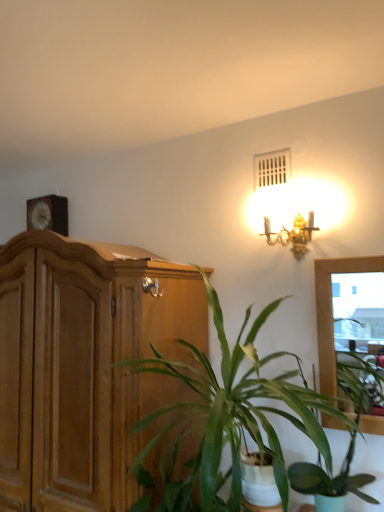
Question: Which direction should I rotate to look at green leafy plant at center, the 1th houseplant positioned from the right, — up or down?

Choices:
 (A) down
 (B) up

Answer: (A)

Question: Is gold metallic sconce at upper right taller than green leafy plant at center, marked as the second houseplant in a right-to-left arrangement?

Choices:
 (A) no
 (B) yes

Answer: (A)

Question: Is gold metallic sconce at upper right oriented towards green leafy plant at center, marked as the second houseplant in a right-to-left arrangement?

Choices:
 (A) yes
 (B) no

Answer: (B)

Question: Is gold metallic sconce at upper right outside of green leafy plant at center, the 1th houseplant when ordered from left to right?

Choices:
 (A) no
 (B) yes

Answer: (B)

Question: Is gold metallic sconce at upper right thinner than green leafy plant at center, the 1th houseplant when ordered from left to right?

Choices:
 (A) yes
 (B) no

Answer: (A)

Question: Does gold metallic sconce at upper right have a larger size compared to green leafy plant at center, the 1th houseplant when ordered from left to right?

Choices:
 (A) yes
 (B) no

Answer: (B)

Question: Is gold metallic sconce at upper right far away from green leafy plant at center, the 1th houseplant when ordered from left to right?

Choices:
 (A) yes
 (B) no

Answer: (B)

Question: Does green leafy plant at center, marked as the second houseplant in a right-to-left arrangement, turn towards green leafy plant at center, the 1th houseplant positioned from the right?

Choices:
 (A) no
 (B) yes

Answer: (A)

Question: Is green leafy plant at center, marked as the second houseplant in a right-to-left arrangement, bigger than green leafy plant at center, the 1th houseplant positioned from the right?

Choices:
 (A) yes
 (B) no

Answer: (A)

Question: Is green leafy plant at center, marked as the second houseplant in a right-to-left arrangement, closer to the viewer compared to green leafy plant at center, marked as the second houseplant in a left-to-right arrangement?

Choices:
 (A) yes
 (B) no

Answer: (A)

Question: From the image's perspective, would you say green leafy plant at center, marked as the second houseplant in a right-to-left arrangement, is shown under green leafy plant at center, the 1th houseplant positioned from the right?

Choices:
 (A) yes
 (B) no

Answer: (B)

Question: Is green leafy plant at center, marked as the second houseplant in a right-to-left arrangement, in contact with green leafy plant at center, the 1th houseplant positioned from the right?

Choices:
 (A) yes
 (B) no

Answer: (B)

Question: Is green leafy plant at center, marked as the second houseplant in a right-to-left arrangement, positioned with its back to green leafy plant at center, marked as the second houseplant in a left-to-right arrangement?

Choices:
 (A) no
 (B) yes

Answer: (B)

Question: Does wooden cabinet at left appear on the left side of green leafy plant at center, marked as the second houseplant in a left-to-right arrangement?

Choices:
 (A) yes
 (B) no

Answer: (A)